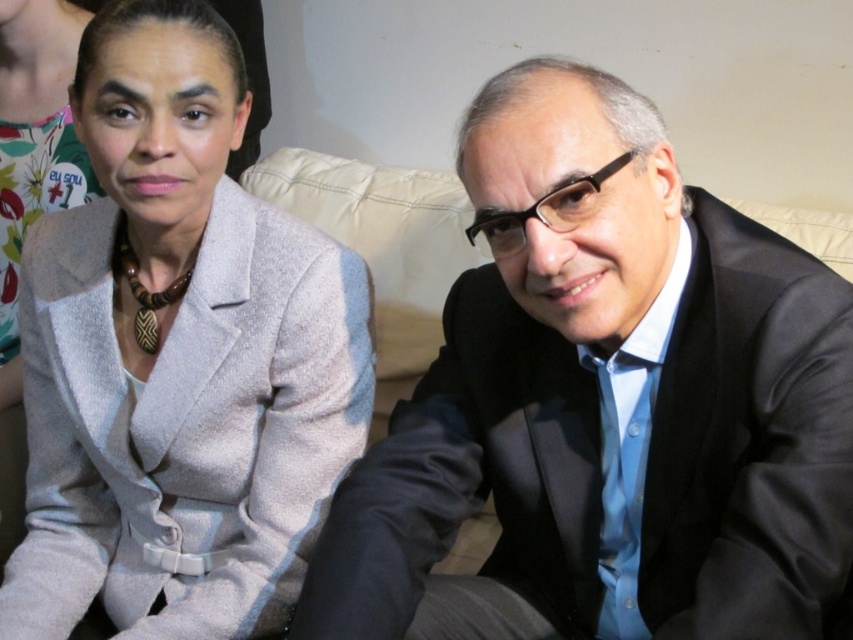
Consider the image. You are a photographer setting up a shoot with two people. You notice the matte gray blazer at center and the matte gray blazer at upper left in the frame. Which blazer should you adjust to ensure the one in front is fully visible?

You should adjust the matte gray blazer at upper left because the matte gray blazer at center is in front of it, so moving the upper left one back or repositioning it would help keep the central blazer visible.

You are a photographer setting up a shoot with two people. You notice the matte gray blazer at center and the matte gray blazer at upper left in the scene. Which blazer is positioned to the right of the other?

The matte gray blazer at center is to the right of the matte gray blazer at upper left.

You are a photographer setting up for a portrait session. You need to position a spotlight to the left of the matte gray blazer at center. Will the spotlight be to the left of the black glossy suit at right?

The black glossy suit at right is to the right of the matte gray blazer at center. Placing the spotlight to the left of the matte gray blazer at center means it will also be to the left of the black glossy suit at right since the blazer is closer to the center than the suit.